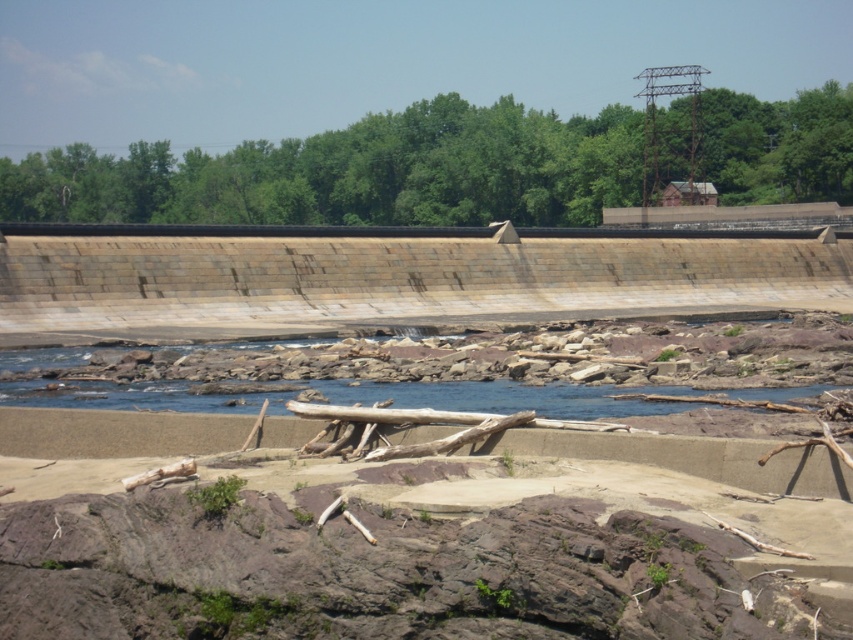
Question: Which point is closer to the camera?

Choices:
 (A) (534, 387)
 (B) (15, 225)

Answer: (A)

Question: Does brown stone dam at center have a greater width compared to clear water at center?

Choices:
 (A) no
 (B) yes

Answer: (B)

Question: Can you confirm if brown stone dam at center is smaller than clear water at center?

Choices:
 (A) yes
 (B) no

Answer: (B)

Question: Does brown stone dam at center lie behind clear water at center?

Choices:
 (A) yes
 (B) no

Answer: (A)